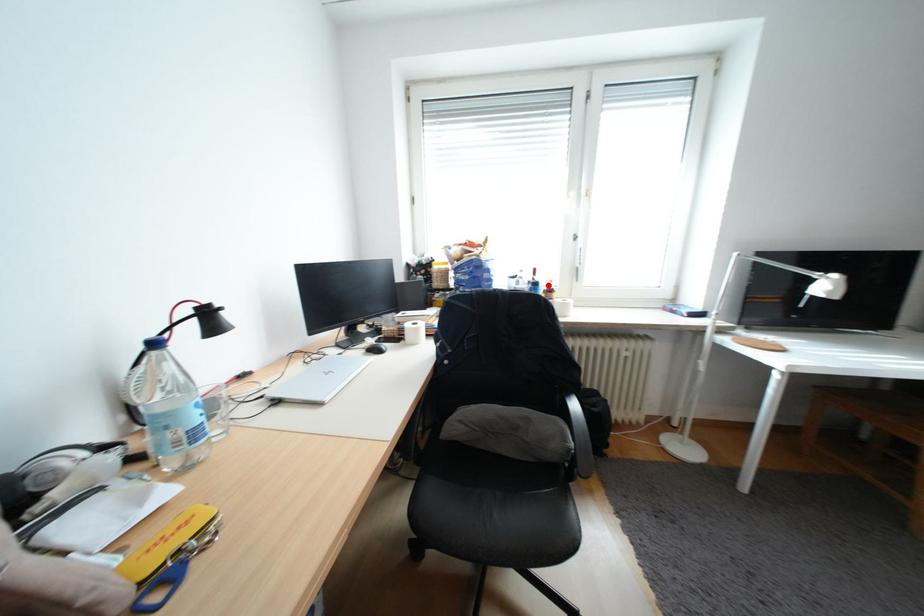
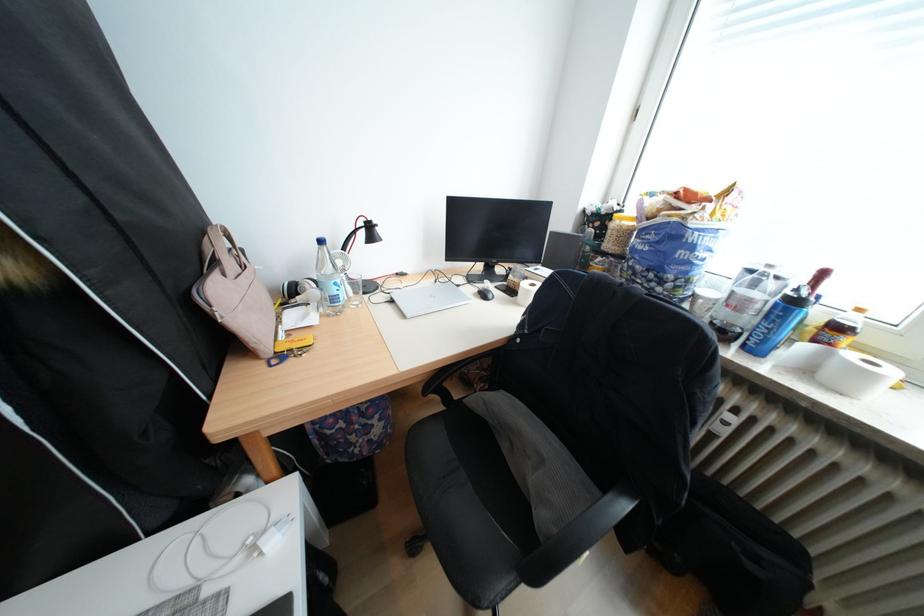
Find the pixel in the second image that matches the highlighted location in the first image.

(808, 302)